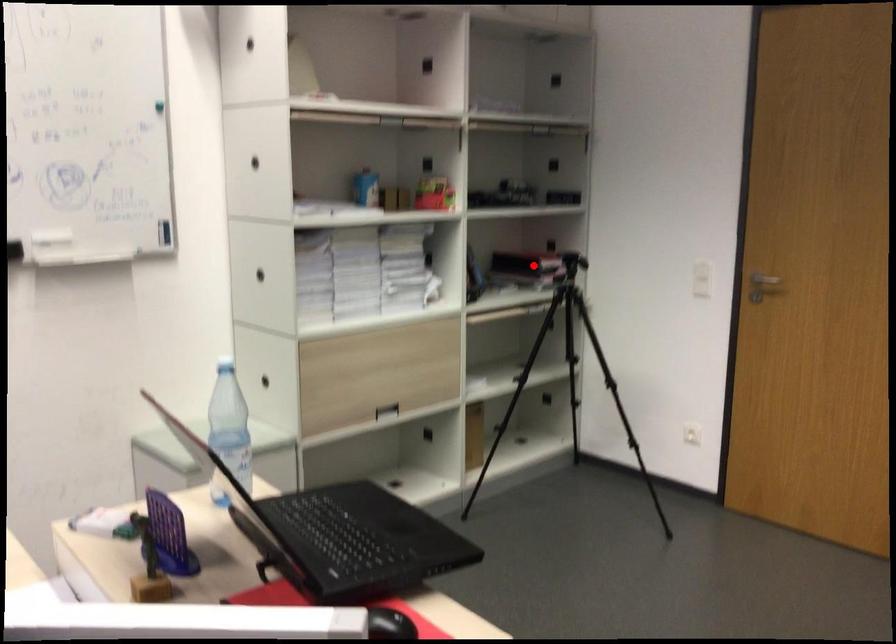
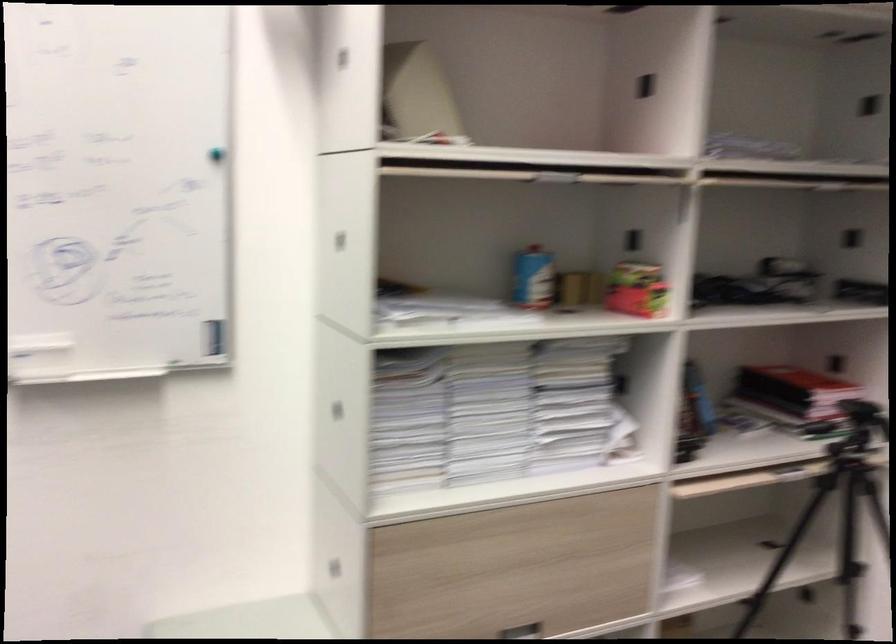
Question: I am providing you with two images of the same scene from different viewpoints. Image1 has a red point marked. In image2, the corresponding 3D location appears at what relative position? Reply with the corresponding letter.

Choices:
 (A) Closer
 (B) Farther

Answer: (A)